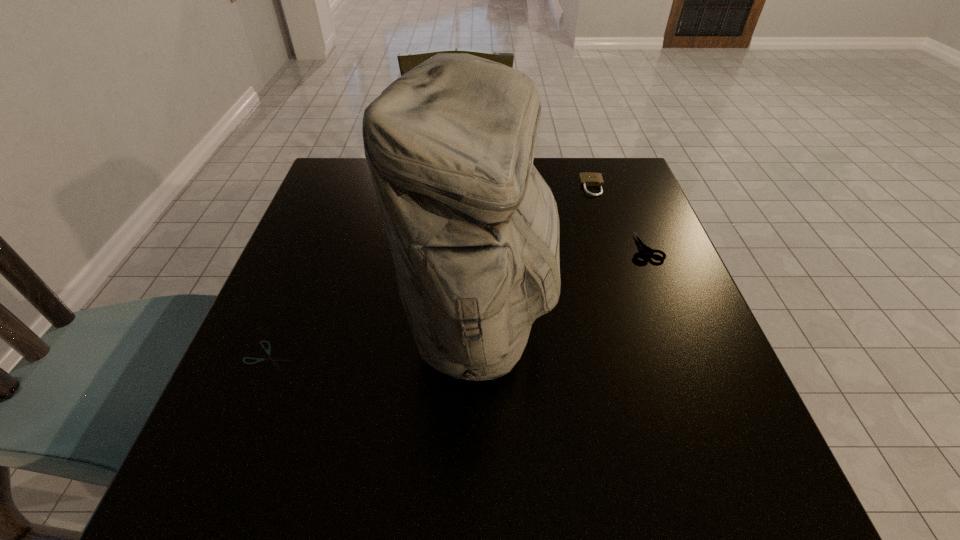
This screenshot has height=540, width=960. I want to click on object that ranks as the third closest to the third object from left to right, so click(270, 358).

This screenshot has height=540, width=960. I want to click on the closest object to the tallest object, so click(x=270, y=358).

The height and width of the screenshot is (540, 960). Find the location of `free point that satisfies the following two spatial constraints: 1. on the front side of the taller shears; 2. on the front-facing side of the backpack`. free point that satisfies the following two spatial constraints: 1. on the front side of the taller shears; 2. on the front-facing side of the backpack is located at coordinates (675, 324).